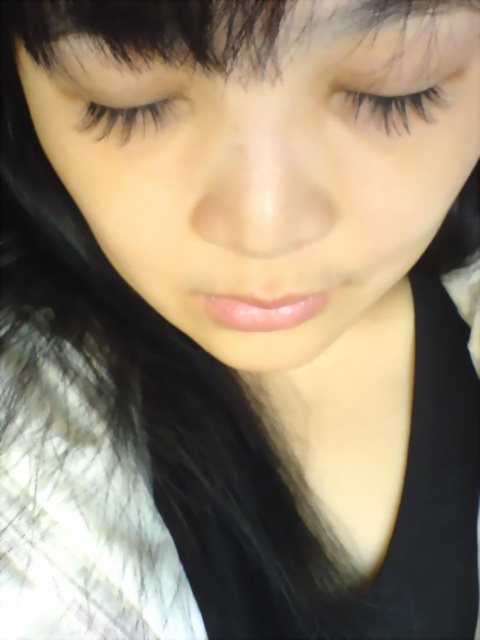
You are a makeup artist analyzing the portrait. The black eyelashes at upper center are located at coordinates 0.164, 0.802. If you were to apply false lashes, where would you place them relative to the existing eyelashes?

The black eyelashes at upper center are located at point (384, 104), so you should place the false lashes directly on top of the existing eyelashes at that coordinate to ensure proper alignment and natural appearance.

Looking at the person in the image, which of the two black eyelashes, the black eyelashes at upper center or the black eyelashes at upper left, is positioned more to the right?

The black eyelashes at upper center is positioned more to the right than the black eyelashes at upper left.